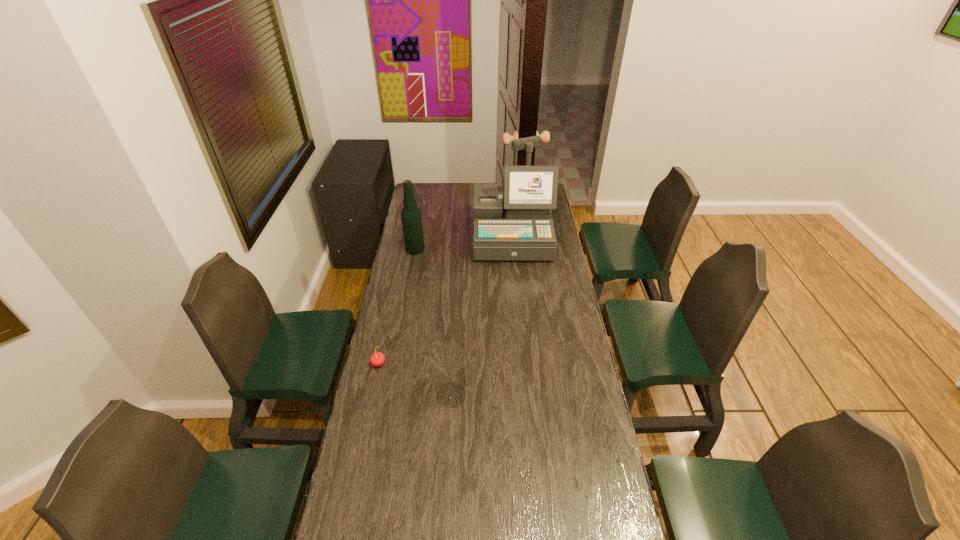
The image size is (960, 540). In order to click on the tallest object in this screenshot , I will do 518,226.

At what (x,y) coordinates should I click in order to perform the action: click on the rightmost object. Please return your answer as a coordinate pair (x, y). The width and height of the screenshot is (960, 540). Looking at the image, I should click on (518, 226).

Locate an element on the screen. This screenshot has width=960, height=540. the second tallest object is located at coordinates (411, 218).

In order to click on the nearest object in this screenshot , I will do `click(448, 358)`.

The width and height of the screenshot is (960, 540). I want to click on flute glass, so click(x=448, y=358).

Locate an element on the screen. cherry is located at coordinates (377, 359).

Where is `the shortest object`? the shortest object is located at coordinates (377, 359).

You are a GUI agent. You are given a task and a screenshot of the screen. Output one action in this format:
    pyautogui.click(x=<x>, y=<y>)
    Task: Click on the vacant region located 0.210m on the customer-facing side of the rightmost object
    
    Given the screenshot: What is the action you would take?
    pyautogui.click(x=516, y=293)

Image resolution: width=960 pixels, height=540 pixels. Identify the location of vacant space located 0.090m on the front of the alcohol. (412, 267).

I want to click on vacant space located 0.200m on the front of the second shortest object, so click(x=447, y=467).